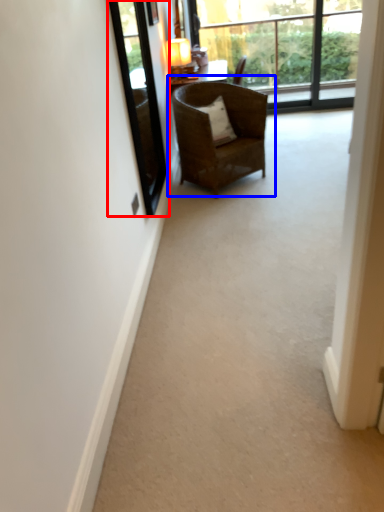
Question: Which object is closer to the camera taking this photo, window screen (highlighted by a red box) or chair (highlighted by a blue box)?

Choices:
 (A) window screen
 (B) chair

Answer: (A)